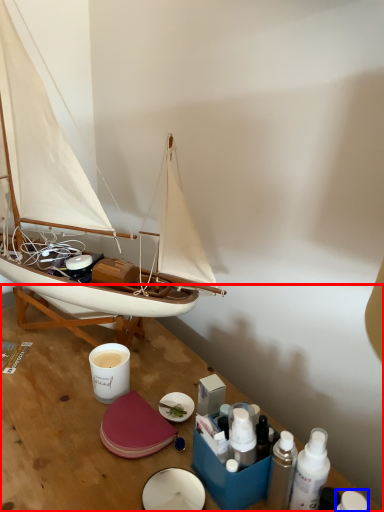
Question: Which object is closer to the camera taking this photo, table (highlighted by a red box) or toiletry (highlighted by a blue box)?

Choices:
 (A) table
 (B) toiletry

Answer: (A)